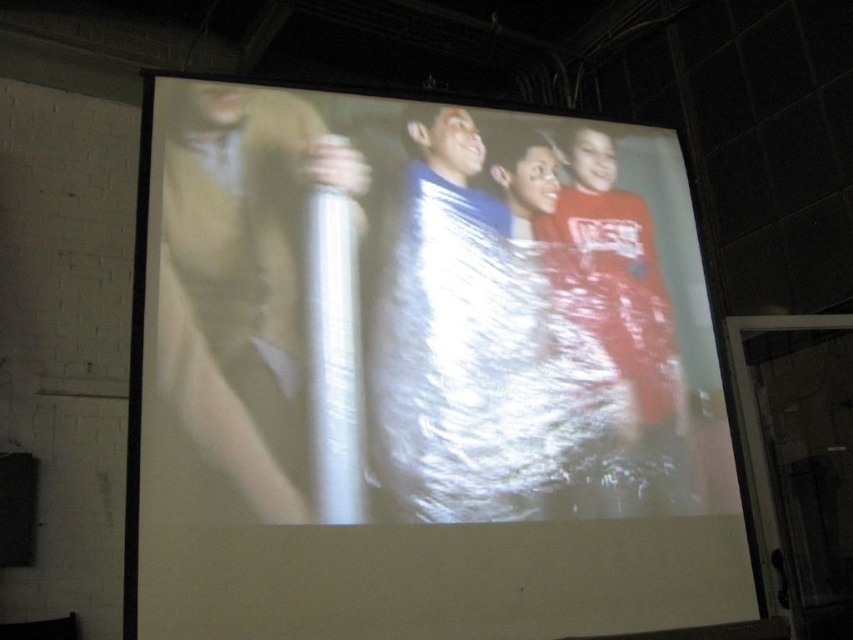
You are setting up a presentation and need to place a 12 inch projector stand between the white glossy screen at center and the metallic silver canister at left. Will there be enough space to fit the stand between them without moving either object?

The white glossy screen at center and metallic silver canister at left are 11.42 inches apart. Since the projector stand is 12 inches long, there isn not enough space to fit it between them without moving either object.

You are setting up a presentation and need to ensure that the white glossy screen at center is visible from the back of the room. Considering the metallic silver canister at left is blocking some light, which object should you adjust to improve visibility?

The white glossy screen at center is taller than the metallic silver canister at left, so adjusting the position of the metallic silver canister at left to move it out of the light path would improve visibility.

You are setting up a presentation and need to ensure that the white glossy screen at center can accommodate a wide audience. Considering the metallic silver canister at left is 20 cm in diameter, what is the minimum width the screen should have to be suitable for a standard conference room?

The white glossy screen at center might be wider than the metallic silver canister at left, which is 20 cm in diameter. To accommodate a standard conference room, the screen should be at least 1.5 meters wide to ensure proper visibility for all attendees.